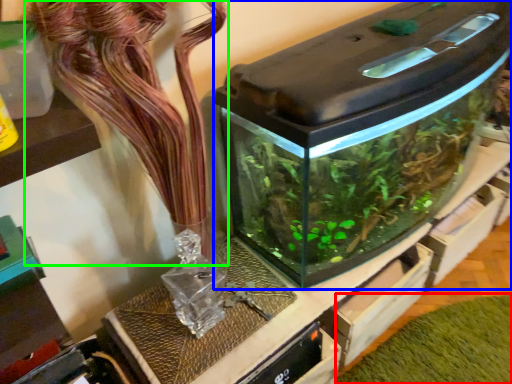
Question: Considering the real-world distances, which object is farthest from plant (highlighted by a red box)? water tank (highlighted by a blue box) or flower (highlighted by a green box)?

Choices:
 (A) water tank
 (B) flower

Answer: (B)